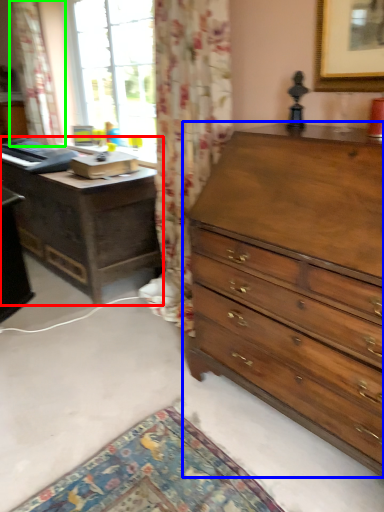
Question: Considering the real-world distances, which object is farthest from nightstand (highlighted by a red box)? chest of drawers (highlighted by a blue box) or curtain (highlighted by a green box)?

Choices:
 (A) chest of drawers
 (B) curtain

Answer: (A)